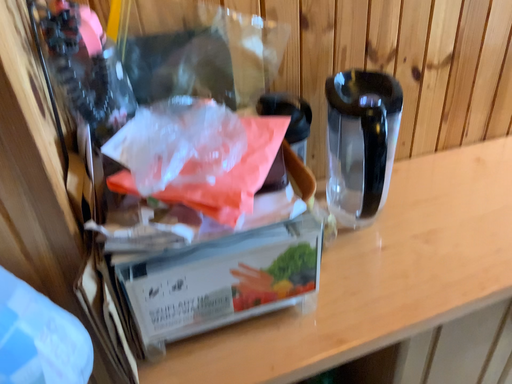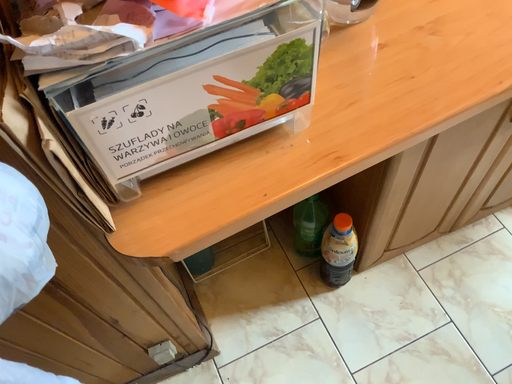
Question: Which way did the camera rotate in the video?

Choices:
 (A) rotated downward
 (B) rotated upward

Answer: (A)